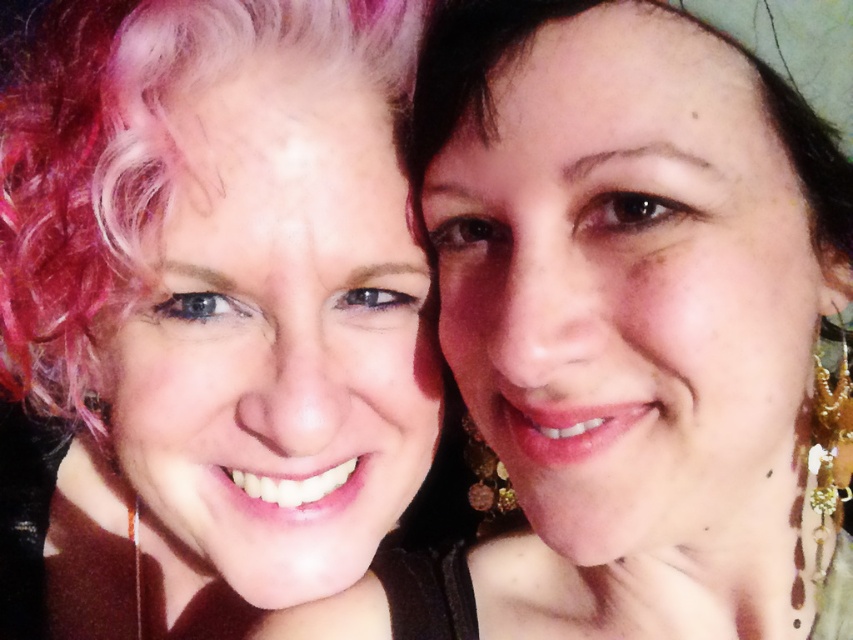
You are a photographer who wants to ensure both the matte gold earrings at right and the pink curly hair at center are clearly visible in the photo. Given their sizes, which object should you focus on first to ensure both are in focus?

The matte gold earrings at right is smaller than the pink curly hair at center, so focusing on the pink curly hair at center first will ensure both are in focus since it is larger and easier to capture clearly.

You are a photographer adjusting the lighting for a portrait. You need to ensure that the matte gold earrings at right are well lit. Given that the main light source is positioned at the point with coordinates point (630, 324), where should you place the light to best highlight the matte gold earrings at right?

The main light source is already positioned at point (630, 324), which indicates the location of the matte gold earrings at right. To best highlight them, position the light slightly to the side and above the earrings to create a soft, directional light that enhances their details without causing harsh shadows.